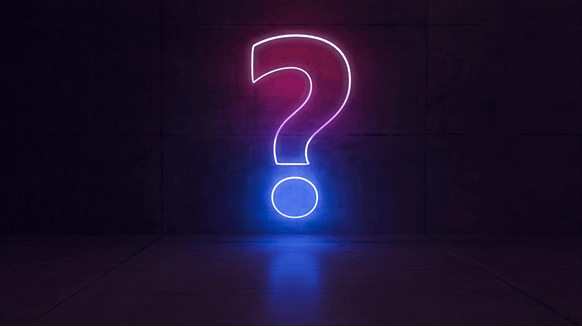
Where is `line where wall meets floor`? line where wall meets floor is located at coordinates (118, 237), (237, 236), (454, 236).